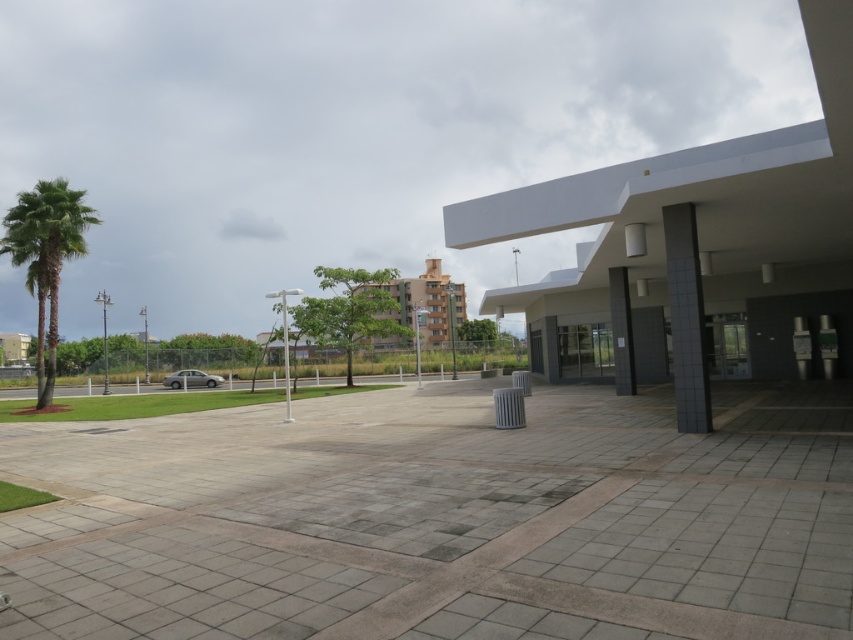
Based on the photo, you are standing at the bottom center of the image. Looking towards the green leafy palm tree at left, in which direction should you walk to reach it?

The green leafy palm tree at left is located at point (45, 259). Since you are at the bottom center, you should walk towards the left to reach it.

You are standing at the bottom left corner of the paved area and want to walk directly towards the black tile pillar at right. What direction should you head in?

You should head towards the right and upward direction to reach the black tile pillar at right, as it is positioned at coordinates point (686, 320).